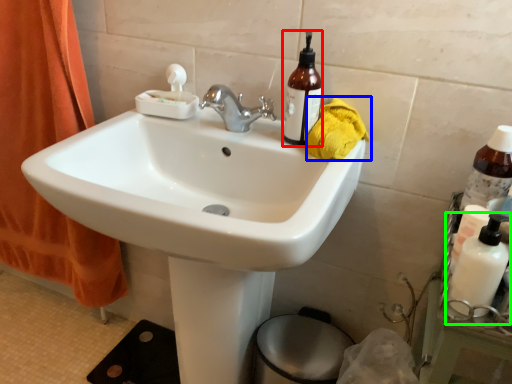
Question: Considering the real-world distances, which object is closest to bottle (highlighted by a red box)? material (highlighted by a blue box) or cleaning product (highlighted by a green box).

Choices:
 (A) material
 (B) cleaning product

Answer: (A)